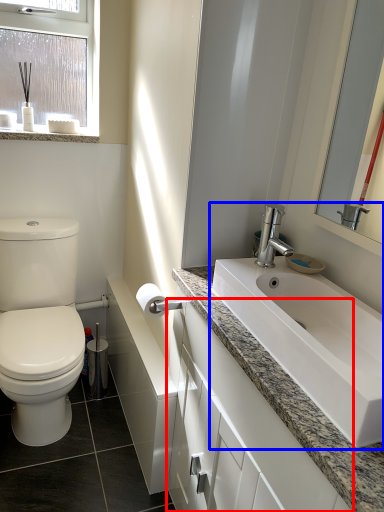
Question: Among these objects, which one is nearest to the camera, bathroom cabinet (highlighted by a red box) or sink (highlighted by a blue box)?

Choices:
 (A) bathroom cabinet
 (B) sink

Answer: (A)